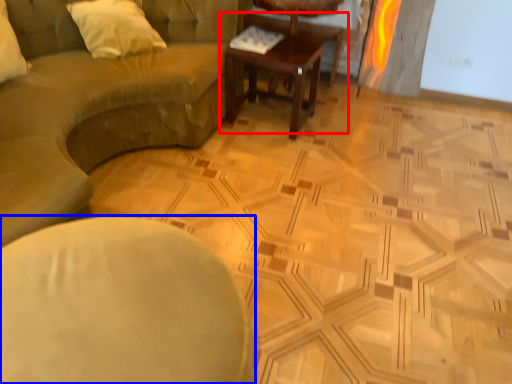
Question: Which point is further to the camera, coffee table (highlighted by a red box) or chair (highlighted by a blue box)?

Choices:
 (A) coffee table
 (B) chair

Answer: (A)